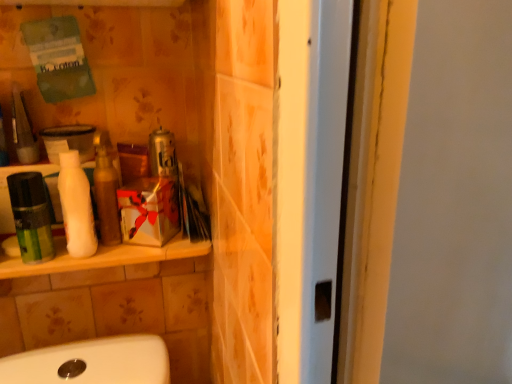
Question: Would you say green matte mouthwash at left is inside or outside white matte bottle at left?

Choices:
 (A) inside
 (B) outside

Answer: (B)

Question: Based on their positions, is green matte mouthwash at left located to the left or right of white matte bottle at left?

Choices:
 (A) right
 (B) left

Answer: (B)

Question: Estimate the real-world distances between objects in this image. Which object is farther from the white matte lotion at left?

Choices:
 (A) metallic can at center
 (B) green matte mouthwash at left
 (C) white matte bottle at left

Answer: (B)

Question: Estimate the real-world distances between objects in this image. Which object is farther from the white matte lotion at left?

Choices:
 (A) green matte mouthwash at left
 (B) metallic can at center
 (C) white matte bottle at left

Answer: (A)